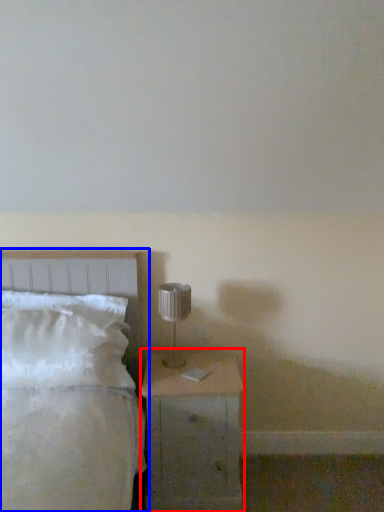
Question: Which of the following is the closest to the observer, nightstand (highlighted by a red box) or bed (highlighted by a blue box)?

Choices:
 (A) nightstand
 (B) bed

Answer: (B)